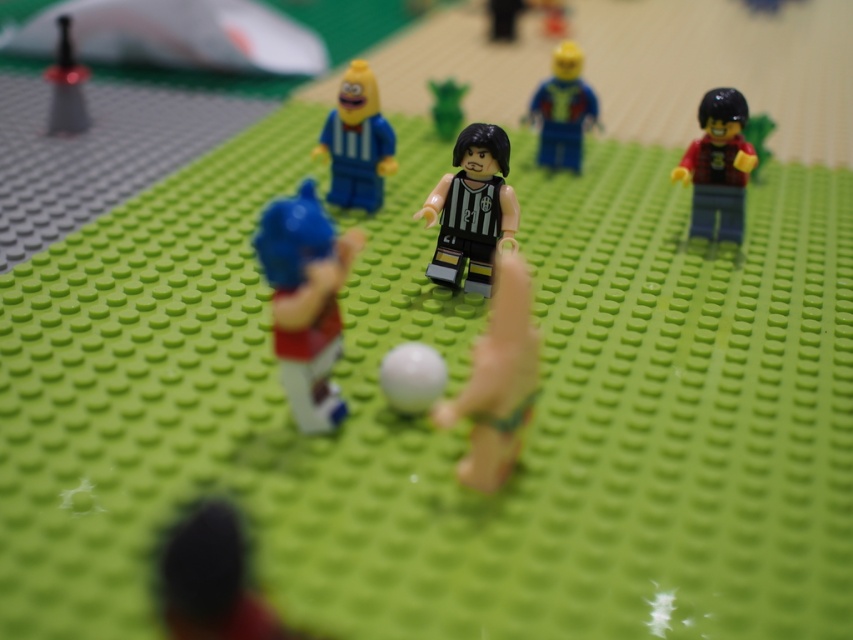
You are a designer working on a project and need to choose between the shiny black pen at upper left and the green matte plant at center for a display. Which object is wider?

The shiny black pen at upper left might be wider than green matte plant at center.